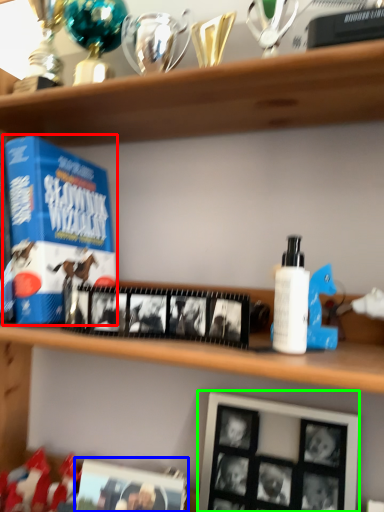
Question: Which is farther away from product (highlighted by a red box)? picture frame (highlighted by a blue box) or picture frame (highlighted by a green box)?

Choices:
 (A) picture frame
 (B) picture frame

Answer: (B)